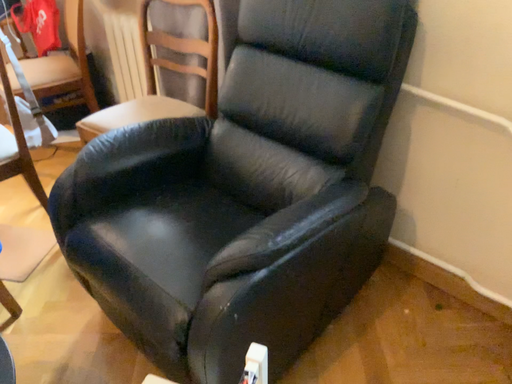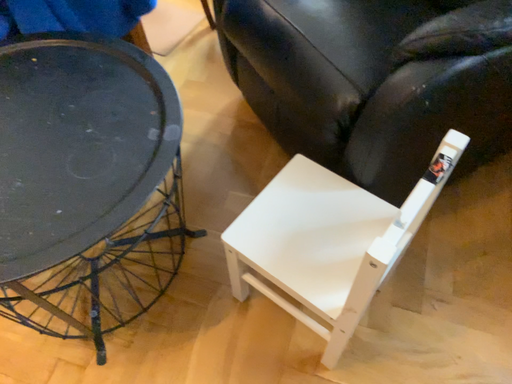
Question: Which way did the camera rotate in the video?

Choices:
 (A) rotated downward
 (B) rotated upward

Answer: (A)